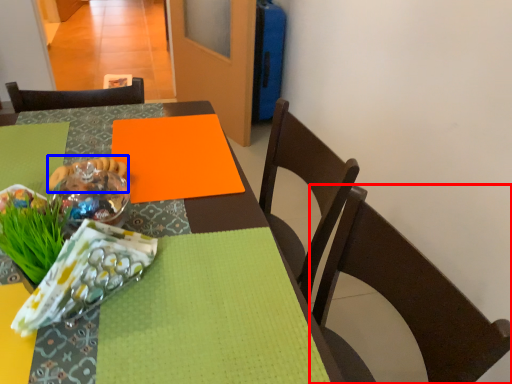
Question: Which object appears closest to the camera in this image, chair (highlighted by a red box) or food (highlighted by a blue box)?

Choices:
 (A) chair
 (B) food

Answer: (A)